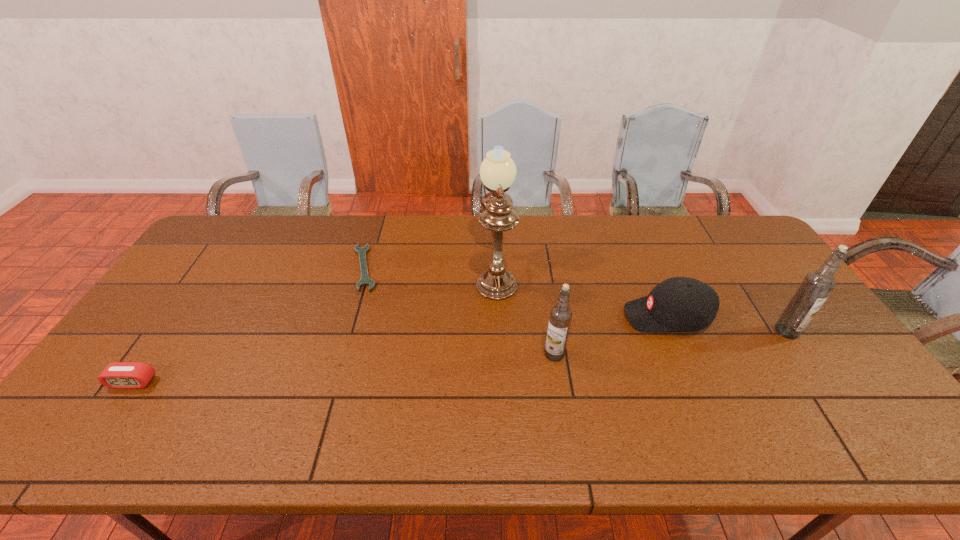
The height and width of the screenshot is (540, 960). In the image, there is a desktop. What are the coordinates of `vacant space at the right edge` in the screenshot? It's located at (835, 349).

The image size is (960, 540). What are the coordinates of `blank space at the far right corner` in the screenshot? It's located at click(755, 253).

This screenshot has width=960, height=540. What are the coordinates of `free space between the third object from left to right and the shorter vodka` in the screenshot? It's located at (525, 313).

Locate an element on the screen. free point between the fourth object from right to left and the fourth tallest object is located at coordinates (582, 294).

Where is `free space between the fifth object from right to left and the third shortest object`? The width and height of the screenshot is (960, 540). free space between the fifth object from right to left and the third shortest object is located at coordinates (516, 292).

You are a GUI agent. You are given a task and a screenshot of the screen. Output one action in this format:
    pyautogui.click(x=<x>, y=<y>)
    Task: Click on the unoccupied area between the wrench and the oil lamp
    Image resolution: width=960 pixels, height=540 pixels.
    Given the screenshot: What is the action you would take?
    pyautogui.click(x=430, y=270)

At what (x,y) coordinates should I click in order to perform the action: click on free spot between the fifth object from right to left and the baseball cap. Please return your answer as a coordinate pair (x, y). The height and width of the screenshot is (540, 960). Looking at the image, I should click on (516, 292).

Identify the location of vacant region between the fifth shortest object and the left vodka. (670, 343).

Locate an element on the screen. The image size is (960, 540). free space that is in between the alarm clock and the third shortest object is located at coordinates (400, 349).

Where is `free spot between the fourth object from right to left and the fourth tallest object`? Image resolution: width=960 pixels, height=540 pixels. free spot between the fourth object from right to left and the fourth tallest object is located at coordinates (582, 294).